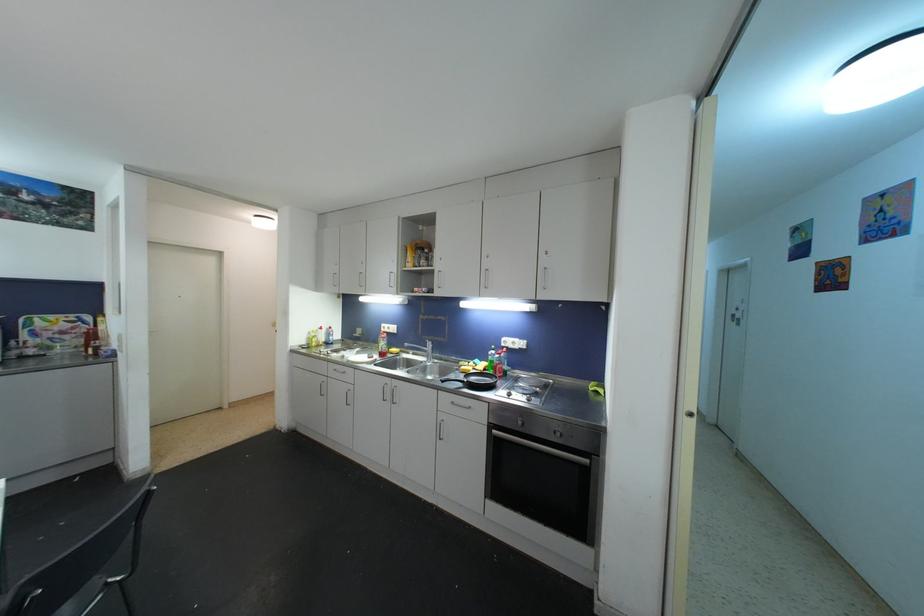
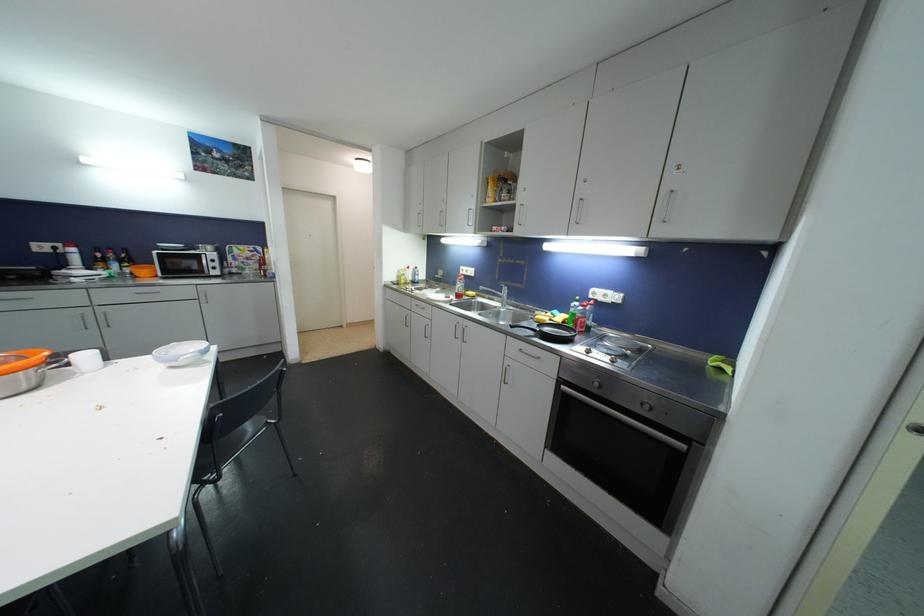
Where in the second image is the point corresponding to (x=132, y=537) from the first image?

(278, 399)